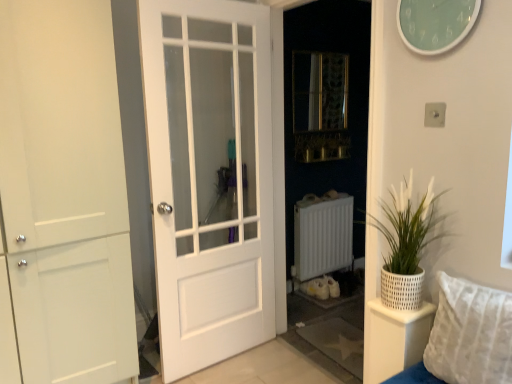
Question: Does metallic mesh at center appear on the right side of white textured pot at right?

Choices:
 (A) yes
 (B) no

Answer: (B)

Question: Is metallic mesh at center taller than white textured pot at right?

Choices:
 (A) yes
 (B) no

Answer: (A)

Question: Does metallic mesh at center have a larger size compared to white textured pot at right?

Choices:
 (A) no
 (B) yes

Answer: (A)

Question: Are metallic mesh at center and white textured pot at right located far from each other?

Choices:
 (A) yes
 (B) no

Answer: (A)

Question: From the image's perspective, is metallic mesh at center on white textured pot at right?

Choices:
 (A) yes
 (B) no

Answer: (A)

Question: Is metallic mesh at center outside of white textured pot at right?

Choices:
 (A) no
 (B) yes

Answer: (B)

Question: Is white textured pot at right far from white matte radiator at center?

Choices:
 (A) no
 (B) yes

Answer: (B)

Question: Is white textured pot at right positioned in front of white matte radiator at center?

Choices:
 (A) no
 (B) yes

Answer: (B)

Question: Can you confirm if white textured pot at right is bigger than white matte radiator at center?

Choices:
 (A) no
 (B) yes

Answer: (A)

Question: Is white textured pot at right located outside white matte radiator at center?

Choices:
 (A) yes
 (B) no

Answer: (A)

Question: From the image's perspective, is white textured pot at right beneath white matte radiator at center?

Choices:
 (A) yes
 (B) no

Answer: (B)

Question: From a real-world perspective, does white textured pot at right stand above white matte radiator at center?

Choices:
 (A) no
 (B) yes

Answer: (B)

Question: Could you tell me if white textured pillow at lower right is facing metallic mesh at center?

Choices:
 (A) no
 (B) yes

Answer: (A)